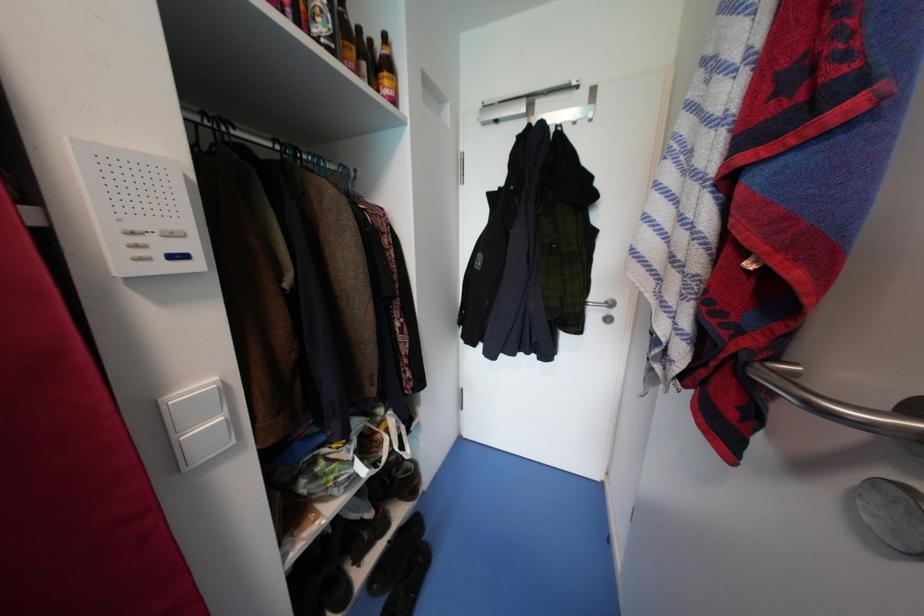
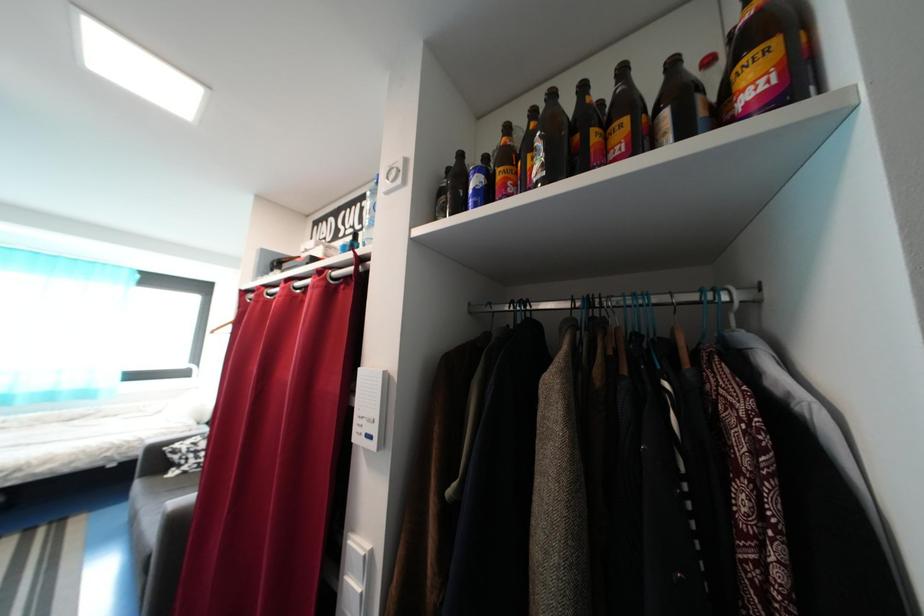
Question: The camera is either moving clockwise (left) or counter-clockwise (right) around the object. The first image is from the beginning of the video and the second image is from the end. Is the camera moving left or right when shooting the video?

Choices:
 (A) Left
 (B) Right

Answer: (B)